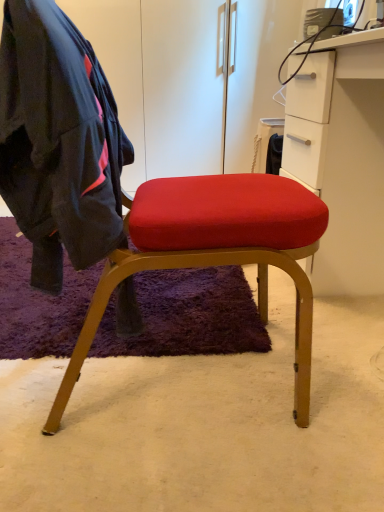
Question: Is point pos(112,129) positioned closer to the camera than point pos(286,95)?

Choices:
 (A) closer
 (B) farther

Answer: (A)

Question: From the image's perspective, is dark blue fabric jacket at left positioned above or below white matte cabinet at right?

Choices:
 (A) below
 (B) above

Answer: (A)

Question: Is dark blue fabric jacket at left wider or thinner than white matte cabinet at right?

Choices:
 (A) thin
 (B) wide

Answer: (A)

Question: From the image's perspective, is white matte cabinet at right positioned above or below dark blue fabric jacket at left?

Choices:
 (A) above
 (B) below

Answer: (A)

Question: In the image, is white matte cabinet at right on the left side or the right side of dark blue fabric jacket at left?

Choices:
 (A) right
 (B) left

Answer: (A)

Question: From a real-world perspective, relative to dark blue fabric jacket at left, is white matte cabinet at right vertically above or below?

Choices:
 (A) above
 (B) below

Answer: (B)

Question: Considering the positions of point (306, 75) and point (3, 53), is point (306, 75) closer or farther from the camera than point (3, 53)?

Choices:
 (A) farther
 (B) closer

Answer: (A)